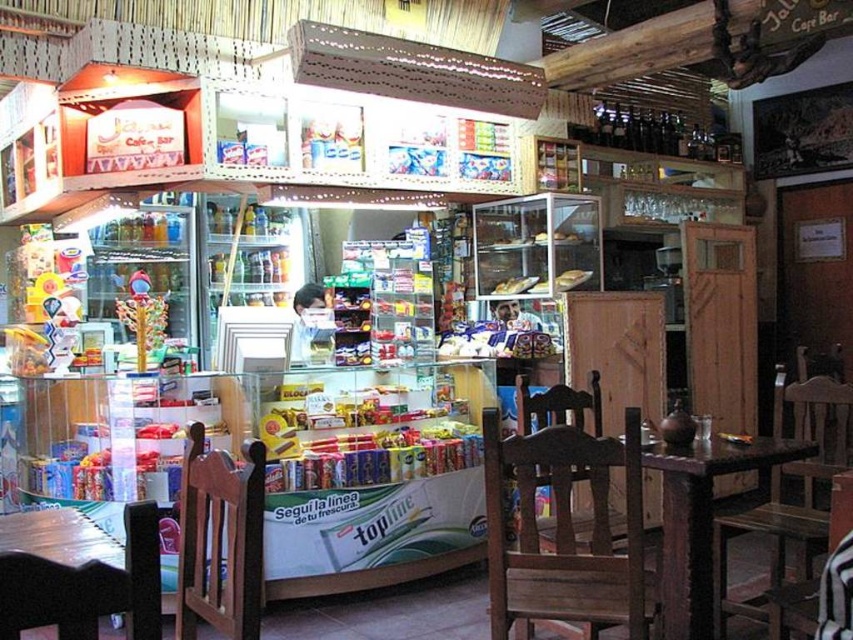
Is point (618, 586) closer to viewer compared to point (664, 637)?

Yes, point (618, 586) is closer to viewer.

Looking at this image, can you confirm if wooden chair at center is taller than dark brown wooden table at center?

No.

The image size is (853, 640). Describe the element at coordinates (564, 529) in the screenshot. I see `wooden chair at center` at that location.

Identify the location of wooden chair at center. Image resolution: width=853 pixels, height=640 pixels. (564, 529).

Is brown wooden chair at lower left shorter than dark brown wooden table at center?

Correct, brown wooden chair at lower left is not as tall as dark brown wooden table at center.

Is point (199, 554) closer to viewer compared to point (699, 627)?

Yes, point (199, 554) is in front of point (699, 627).

I want to click on brown wooden chair at lower left, so click(x=219, y=540).

Does brown wooden chair at lower left appear on the right side of wooden chair at right?

No, brown wooden chair at lower left is not to the right of wooden chair at right.

Which of these two, brown wooden chair at lower left or wooden chair at right, stands taller?

Standing taller between the two is wooden chair at right.

Is point (234, 548) farther from viewer compared to point (819, 397)?

No, (234, 548) is closer to viewer.

Where is `brown wooden chair at lower left`? The image size is (853, 640). brown wooden chair at lower left is located at coordinates (219, 540).